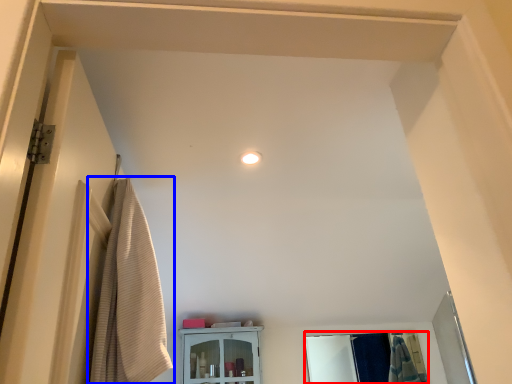
Question: Which point is closer to the camera, mirror (highlighted by a red box) or curtain (highlighted by a blue box)?

Choices:
 (A) mirror
 (B) curtain

Answer: (B)